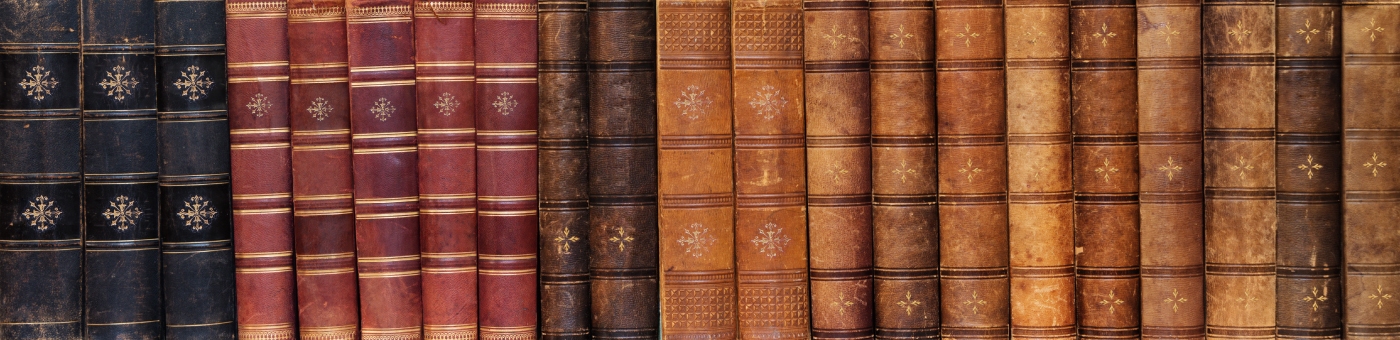
At what (x,y) coordinates should I click in order to perform the action: click on red books. Please return your answer as a coordinate pair (x, y). Image resolution: width=1400 pixels, height=340 pixels. Looking at the image, I should click on (259, 172), (322, 172), (393, 179), (451, 182), (504, 170).